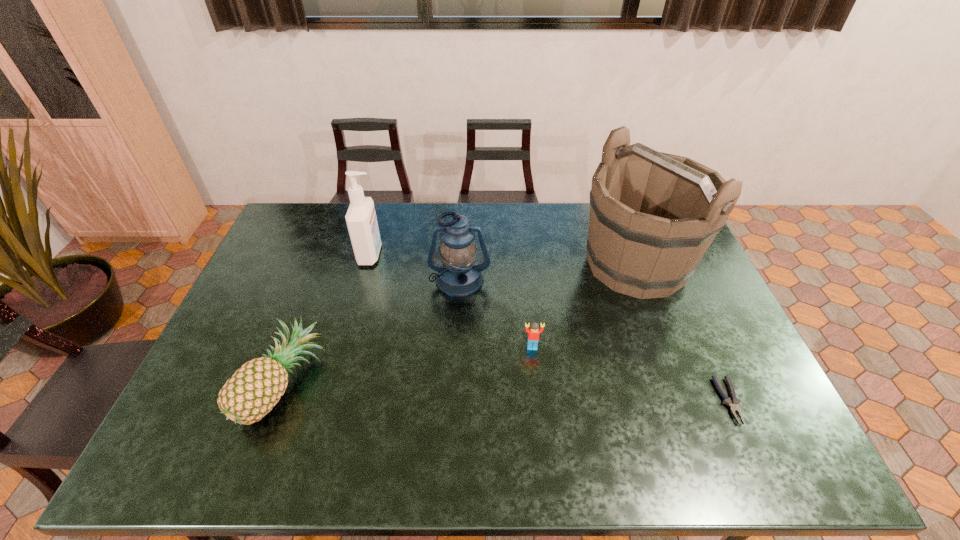
You are a GUI agent. You are given a task and a screenshot of the screen. Output one action in this format:
    pyautogui.click(x=<x>, y=<y>)
    Task: Click on the vacant position located 0.170m on the face of the lantern
    Image resolution: width=960 pixels, height=540 pixels.
    Given the screenshot: What is the action you would take?
    pyautogui.click(x=457, y=341)

I want to click on vacant region located 0.370m on the right of the pineapple, so click(x=468, y=384).

The height and width of the screenshot is (540, 960). I want to click on vacant region located 0.290m on the face of the second shortest object, so click(543, 453).

I want to click on free region located at the gripping part of the pliers, so click(x=756, y=463).

You are a GUI agent. You are given a task and a screenshot of the screen. Output one action in this format:
    pyautogui.click(x=<x>, y=<y>)
    Task: Click on the bucket positioned at the far edge
    The image size is (960, 540).
    Given the screenshot: What is the action you would take?
    pyautogui.click(x=653, y=215)

In order to click on cleansing agent situated at the far edge in this screenshot , I will do `click(361, 220)`.

You are a GUI agent. You are given a task and a screenshot of the screen. Output one action in this format:
    pyautogui.click(x=<x>, y=<y>)
    Task: Click on the object at the near edge
    The image size is (960, 540).
    Given the screenshot: What is the action you would take?
    255,388

This screenshot has width=960, height=540. What are the coordinates of `object present at the left edge` in the screenshot? It's located at (255, 388).

Locate an element on the screen. The width and height of the screenshot is (960, 540). bucket that is at the right edge is located at coordinates (653, 215).

Locate an element on the screen. The width and height of the screenshot is (960, 540). pliers situated at the right edge is located at coordinates (733, 403).